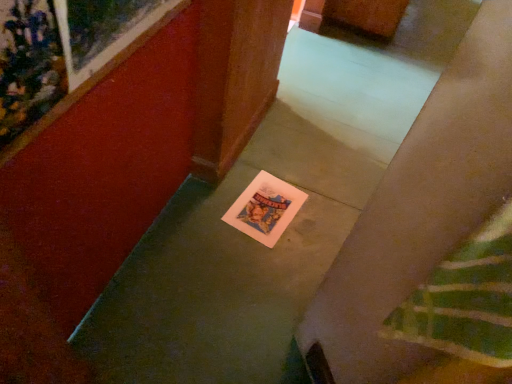
What are the coordinates of `vacant region to the left of white paper postcard at center` in the screenshot? It's located at (206, 204).